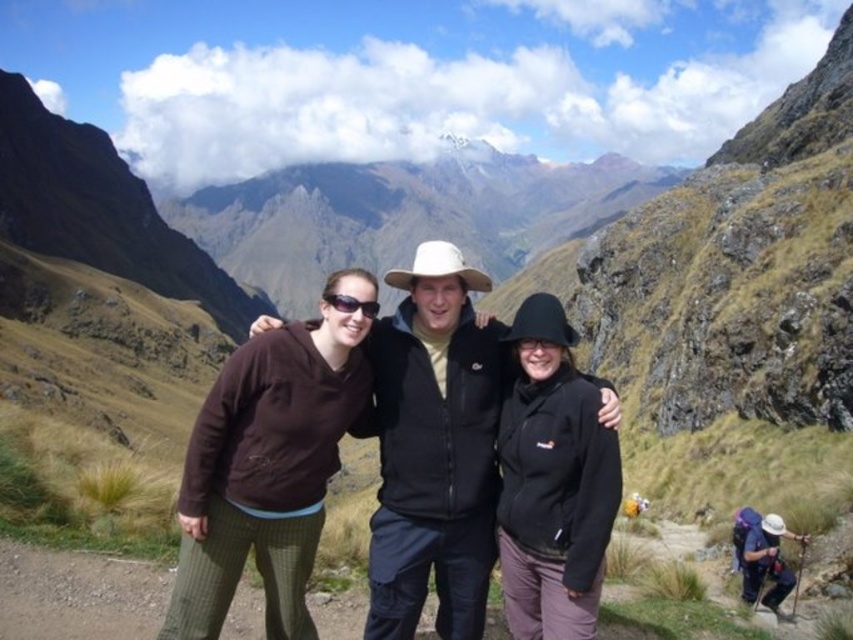
Is point (300, 538) positioned in front of point (521, 358)?

Yes, point (300, 538) is in front of point (521, 358).

Does brown fleece at center have a lesser width compared to black fleece jacket at center?

No.

Where is `brown fleece at center`? This screenshot has width=853, height=640. brown fleece at center is located at coordinates (265, 472).

I want to click on brown fleece at center, so click(265, 472).

Who is more forward, (437, 364) or (236, 520)?

Point (236, 520) is in front.

Which is below, matte black jacket at center or brown fleece at center?

matte black jacket at center

The image size is (853, 640). Describe the element at coordinates (434, 448) in the screenshot. I see `matte black jacket at center` at that location.

Where is `matte black jacket at center`? This screenshot has width=853, height=640. matte black jacket at center is located at coordinates click(x=434, y=448).

Can you confirm if matte black jacket at center is positioned to the right of black matte sunglasses at center?

Yes, matte black jacket at center is to the right of black matte sunglasses at center.

Does matte black jacket at center have a greater width compared to black matte sunglasses at center?

Indeed, matte black jacket at center has a greater width compared to black matte sunglasses at center.

Between point (467, 401) and point (350, 301), which one is positioned behind?

Point (467, 401)

The image size is (853, 640). Identify the location of matte black jacket at center. coord(434,448).